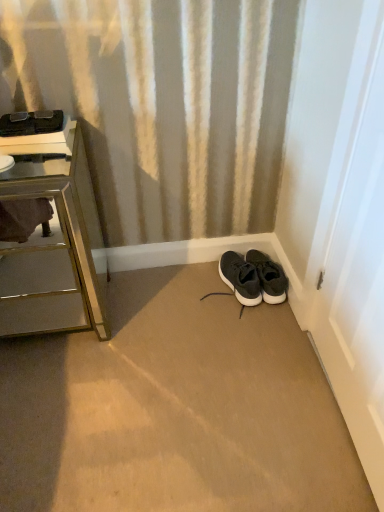
I want to click on vacant area that lies in front of matte black sneaker at lower right, so tap(246, 321).